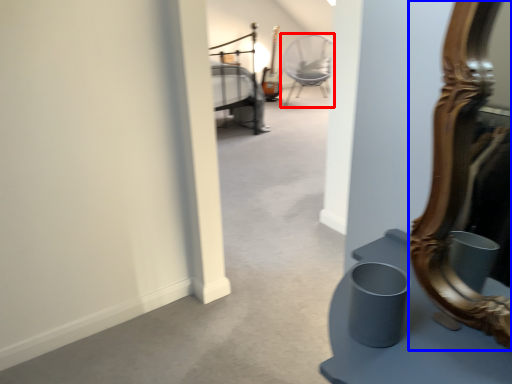
Question: Which point is further to the camera, chair (highlighted by a red box) or mirror (highlighted by a blue box)?

Choices:
 (A) chair
 (B) mirror

Answer: (A)